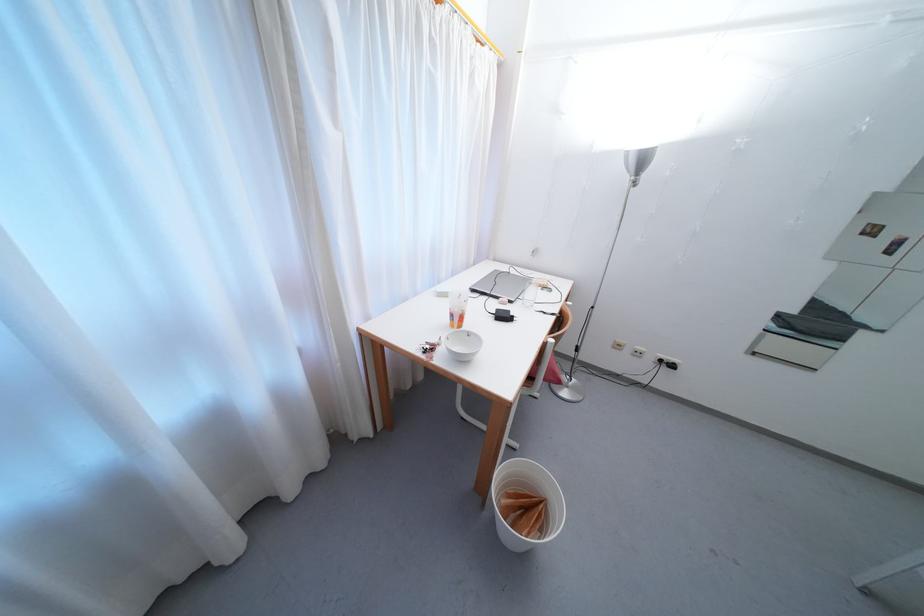
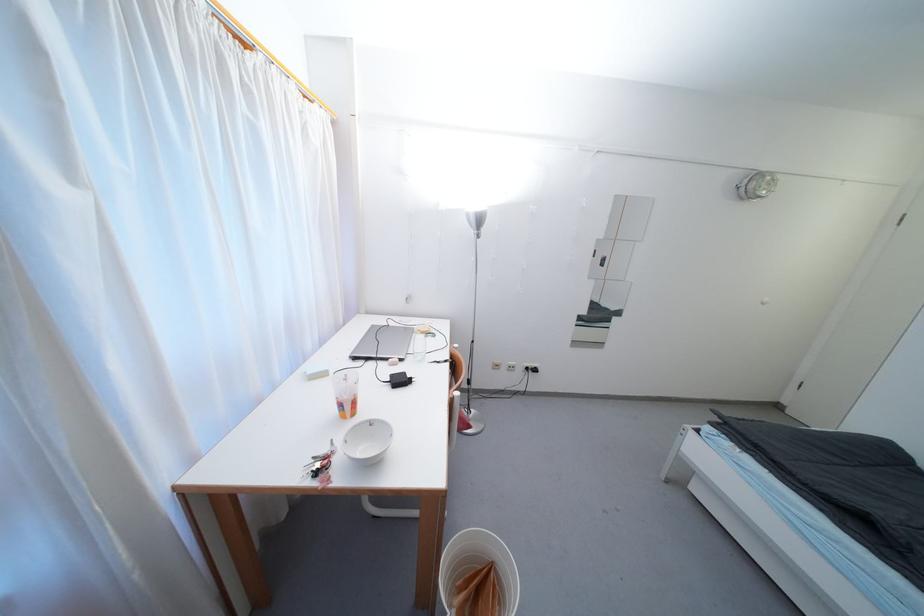
In the second image, find the point that corresponds to [517,274] in the first image.

(395, 326)